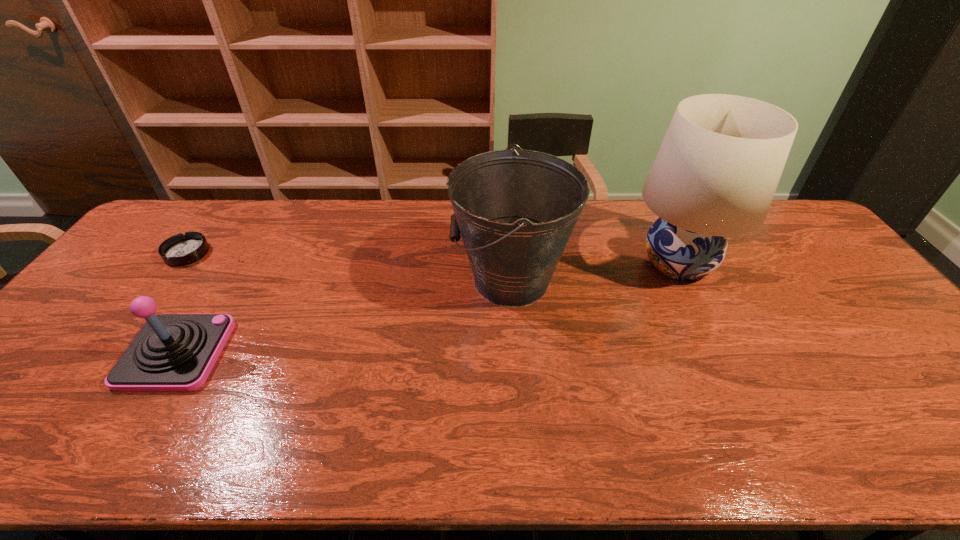
Locate an element on the screen. blank space located with the handle on opposite sides of the third object from left to right is located at coordinates (350, 280).

Find the location of a particular element. vacant space located with the handle on opposite sides of the third object from left to right is located at coordinates (391, 280).

This screenshot has width=960, height=540. Find the location of `vacant area situated 0.280m forward from the base of the second shortest object`. vacant area situated 0.280m forward from the base of the second shortest object is located at coordinates (333, 353).

What are the coordinates of `vacant point located on the right of the ashtray` in the screenshot? It's located at (287, 253).

Identify the location of lampshade that is at the far edge. The image size is (960, 540). (715, 175).

Locate an element on the screen. The height and width of the screenshot is (540, 960). ashtray that is positioned at the far edge is located at coordinates (181, 249).

You are a GUI agent. You are given a task and a screenshot of the screen. Output one action in this format:
    pyautogui.click(x=<x>, y=<y>)
    Task: Click on the object present at the left edge
    This screenshot has width=960, height=540.
    Given the screenshot: What is the action you would take?
    pyautogui.click(x=181, y=249)

This screenshot has height=540, width=960. What are the coordinates of `object positioned at the far left corner` in the screenshot? It's located at (181, 249).

Locate an element on the screen. This screenshot has width=960, height=540. vacant area at the far edge of the desktop is located at coordinates (419, 230).

Identify the location of vacant space at the near edge of the desktop. This screenshot has height=540, width=960. (36, 449).